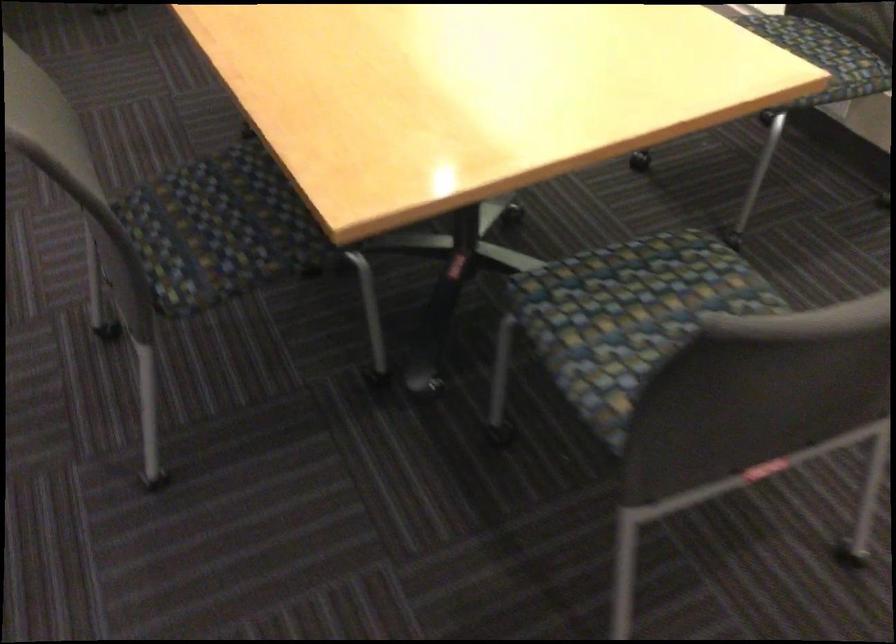
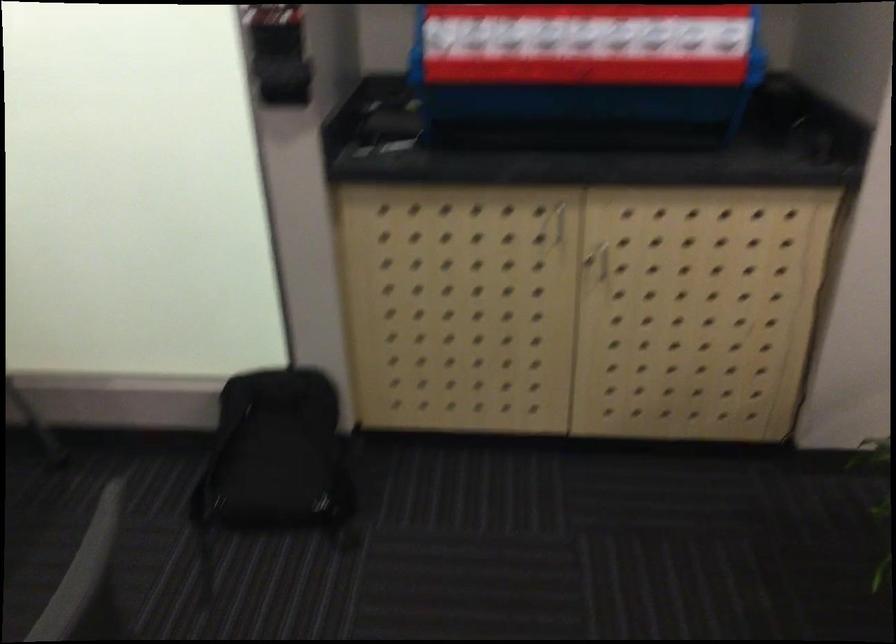
Question: The first image is from the beginning of the video and the second image is from the end. How did the camera likely rotate when shooting the video?

Choices:
 (A) Left
 (B) Right
 (C) Up
 (D) Down

Answer: (B)